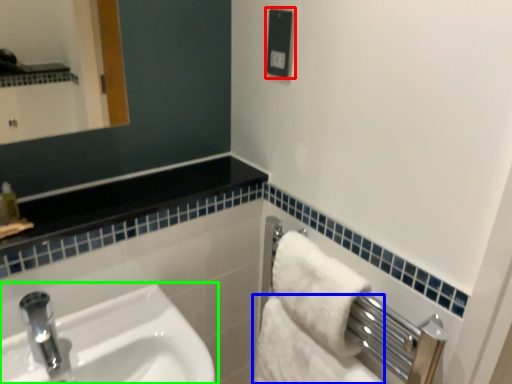
Question: Which object is positioned farthest from electric outlet (highlighted by a red box)? Select from bath towel (highlighted by a blue box) and sink (highlighted by a green box).

Choices:
 (A) bath towel
 (B) sink

Answer: (B)